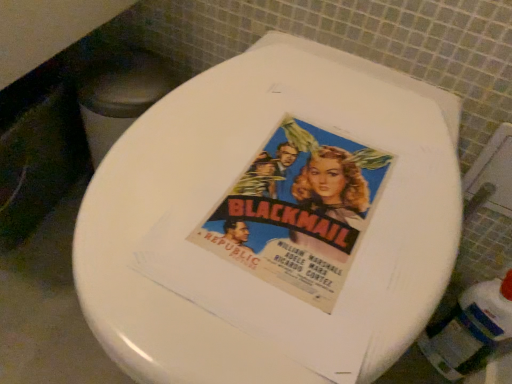
You are a GUI agent. You are given a task and a screenshot of the screen. Output one action in this format:
    pyautogui.click(x=<x>, y=<y>)
    Task: Click on the empty space that is ontop of white glossy toilet seat at center (from a real-world perspective)
    This screenshot has width=512, height=384.
    Given the screenshot: What is the action you would take?
    pyautogui.click(x=296, y=165)